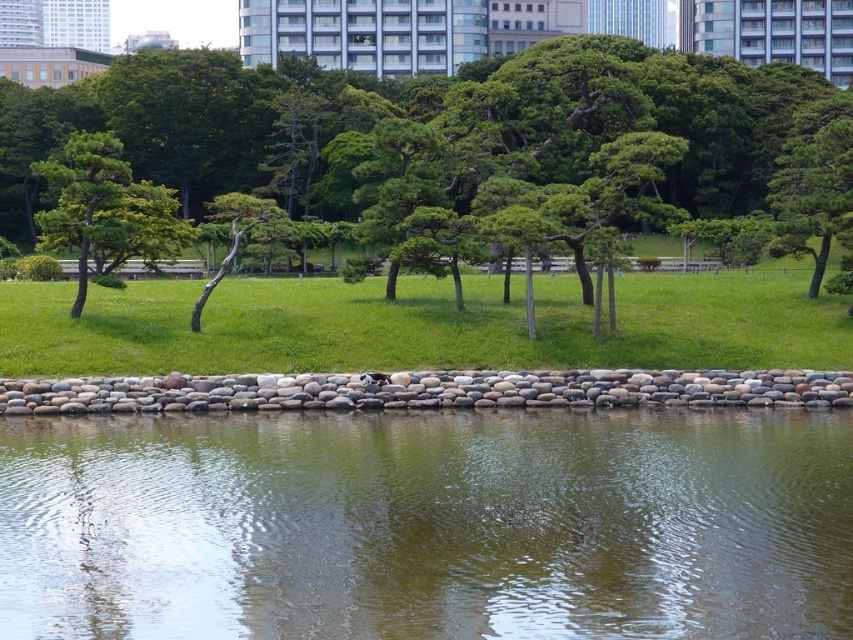
Based on the photo, between green leafy tree at center and green grass at center, which one appears on the left side from the viewer's perspective?

Positioned to the left is green leafy tree at center.

Who is more distant from viewer, (467, 109) or (137, 307)?

The point (467, 109) is behind.

The height and width of the screenshot is (640, 853). What are the coordinates of `green leafy tree at center` in the screenshot? It's located at coord(415,120).

Does point (189, 76) lie in front of point (259, 204)?

No, (189, 76) is further to viewer.

Between point (466, 116) and point (204, 288), which one is positioned in front?

Point (204, 288) is more forward.

This screenshot has width=853, height=640. I want to click on green leafy tree at center, so click(x=415, y=120).

From the picture: Is green grass at center above green leafy tree at upper left?

No, green grass at center is not above green leafy tree at upper left.

Is green grass at center behind green leafy tree at upper left?

No, green grass at center is closer to the viewer.

Is point (337, 323) closer to camera compared to point (88, 196)?

Yes, point (337, 323) is closer to viewer.

You are a GUI agent. You are given a task and a screenshot of the screen. Output one action in this format:
    pyautogui.click(x=<x>, y=<y>)
    Task: Click on the green grass at center
    
    Given the screenshot: What is the action you would take?
    pyautogui.click(x=421, y=324)